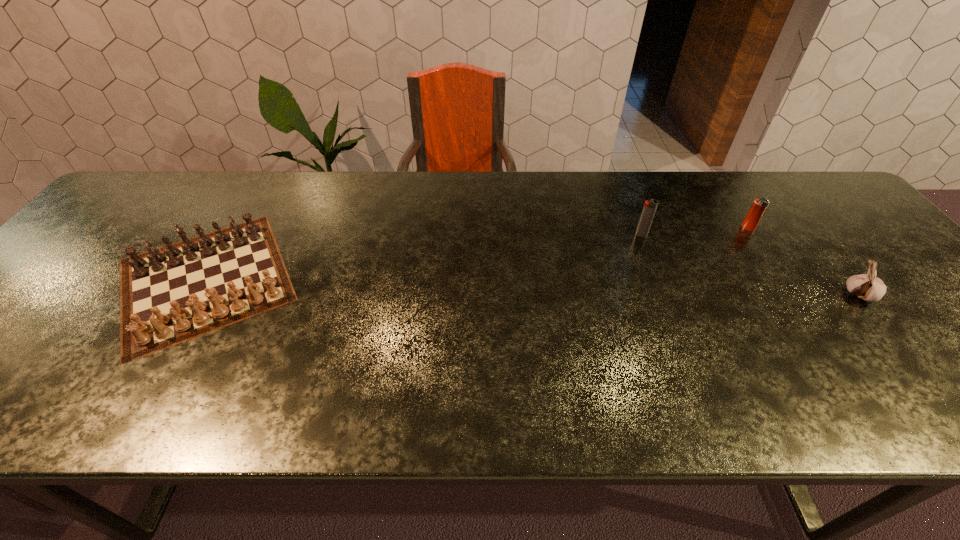
Locate an element on the screen. The image size is (960, 540). object that is the second closest one to the chessboard is located at coordinates (759, 206).

Where is `vacant area in the image that satisfies the following two spatial constraints: 1. on the back side of the third object from right to left; 2. on the left side of the leftmost object`? Image resolution: width=960 pixels, height=540 pixels. vacant area in the image that satisfies the following two spatial constraints: 1. on the back side of the third object from right to left; 2. on the left side of the leftmost object is located at coordinates (231, 235).

Where is `vacant space that satisfies the following two spatial constraints: 1. on the front side of the rightmost object; 2. on the left side of the chessboard`? The width and height of the screenshot is (960, 540). vacant space that satisfies the following two spatial constraints: 1. on the front side of the rightmost object; 2. on the left side of the chessboard is located at coordinates (195, 295).

At what (x,y) coordinates should I click in order to perform the action: click on blank area in the image that satisfies the following two spatial constraints: 1. on the front side of the left igniter; 2. on the left side of the garlic. Please return your answer as a coordinate pair (x, y). The height and width of the screenshot is (540, 960). Looking at the image, I should click on (664, 295).